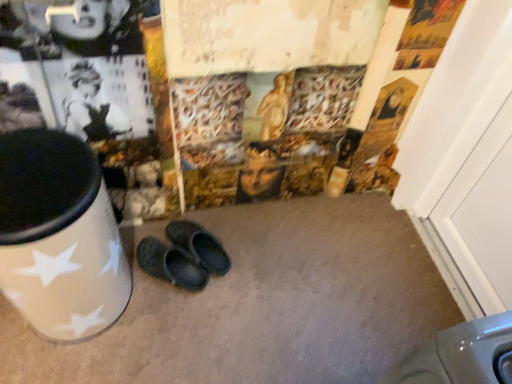
Question: From a real-world perspective, does black rubber clogs at center stand above white glossy waste container at left?

Choices:
 (A) yes
 (B) no

Answer: (B)

Question: From the image's perspective, does black rubber clogs at center appear higher than white glossy waste container at left?

Choices:
 (A) yes
 (B) no

Answer: (B)

Question: From a real-world perspective, does black rubber clogs at center sit lower than white glossy waste container at left?

Choices:
 (A) yes
 (B) no

Answer: (A)

Question: Does black rubber clogs at center have a larger size compared to white glossy waste container at left?

Choices:
 (A) yes
 (B) no

Answer: (B)

Question: Is black rubber clogs at center facing away from white glossy waste container at left?

Choices:
 (A) yes
 (B) no

Answer: (B)

Question: Is black rubber clogs at center completely or partially outside of white glossy waste container at left?

Choices:
 (A) yes
 (B) no

Answer: (A)

Question: Does black rubber clogs at center have a larger size compared to white wood door at right?

Choices:
 (A) yes
 (B) no

Answer: (B)

Question: Is black rubber clogs at center positioned with its back to white wood door at right?

Choices:
 (A) yes
 (B) no

Answer: (B)

Question: Considering the relative positions of black rubber clogs at center and white wood door at right in the image provided, is black rubber clogs at center to the right of white wood door at right from the viewer's perspective?

Choices:
 (A) no
 (B) yes

Answer: (A)

Question: From the image's perspective, is black rubber clogs at center above white wood door at right?

Choices:
 (A) no
 (B) yes

Answer: (A)

Question: Is black rubber clogs at center smaller than white wood door at right?

Choices:
 (A) no
 (B) yes

Answer: (B)

Question: Does black rubber clogs at center have a greater width compared to white wood door at right?

Choices:
 (A) yes
 (B) no

Answer: (A)

Question: Can you confirm if white wood door at right is positioned to the right of black rubber clogs at center?

Choices:
 (A) yes
 (B) no

Answer: (A)